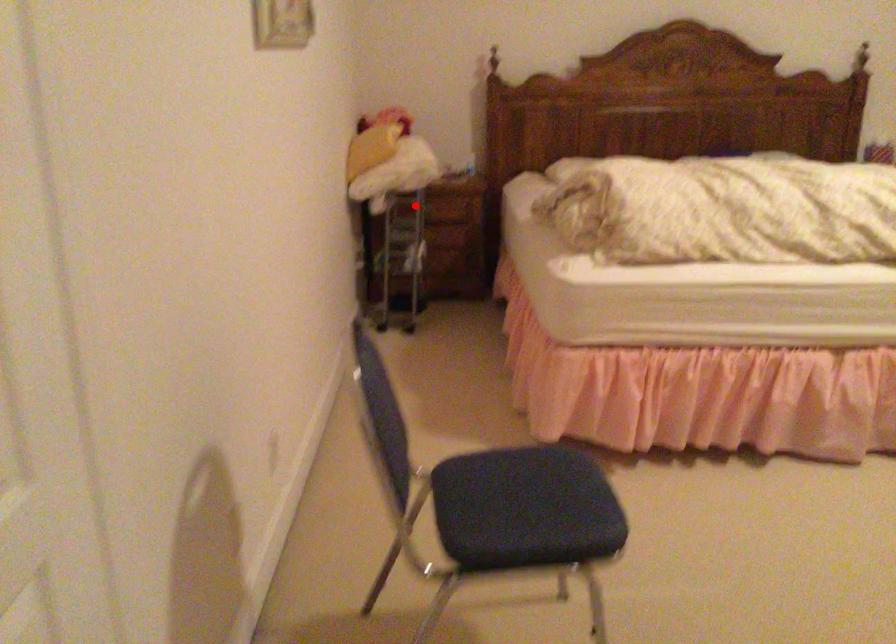
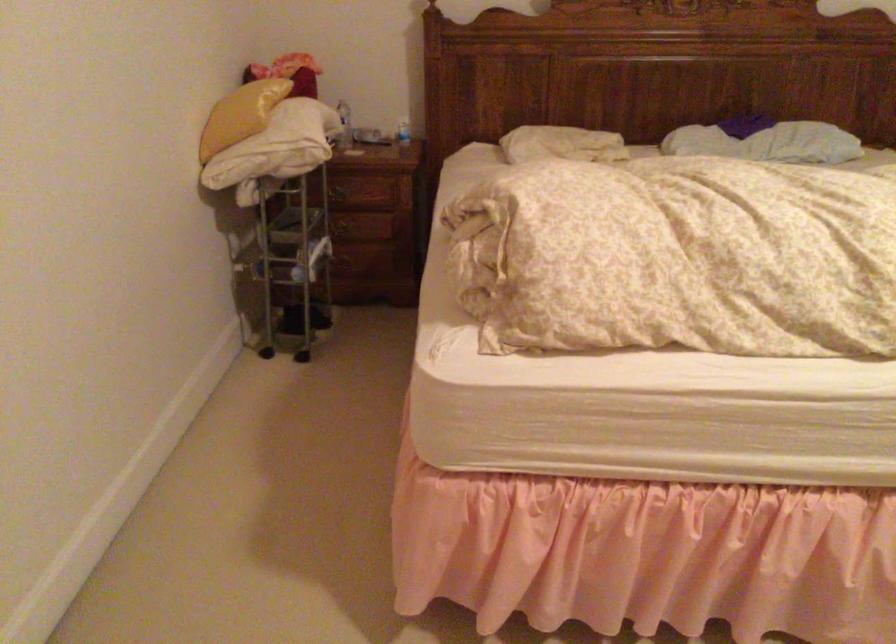
Question: A red point is marked in image1. In image2, is the corresponding 3D point closer to the camera or farther? Reply with the corresponding letter.

Choices:
 (A) The corresponding 3D point is closer.
 (B) The corresponding 3D point is farther.

Answer: (A)